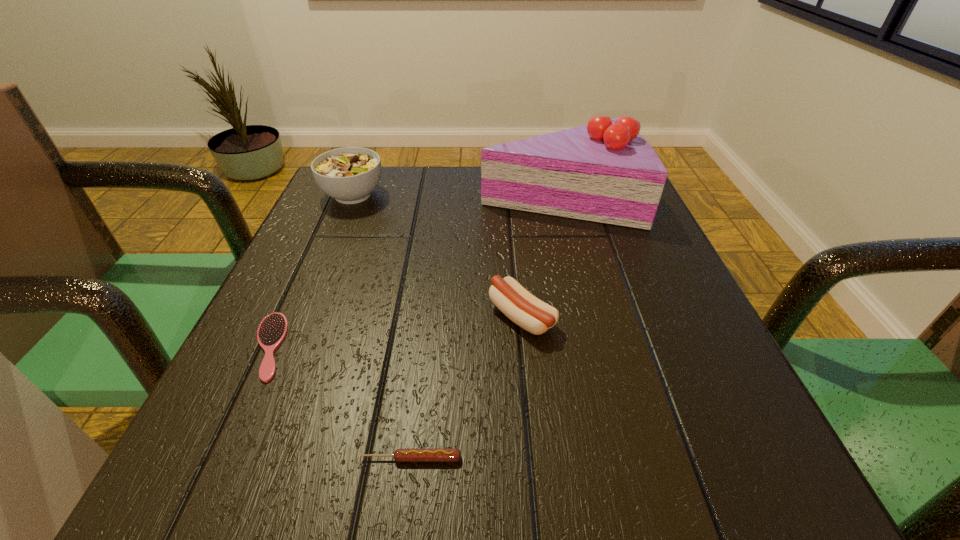
Where is `vacant region at the near edge of the desktop`? This screenshot has width=960, height=540. vacant region at the near edge of the desktop is located at coordinates (496, 464).

Identify the location of vacant space at the left edge. This screenshot has width=960, height=540. (317, 369).

This screenshot has width=960, height=540. I want to click on vacant space at the right edge of the desktop, so click(660, 240).

The width and height of the screenshot is (960, 540). In order to click on vacant space at the near left corner of the desktop in this screenshot , I will do `click(201, 449)`.

You are a GUI agent. You are given a task and a screenshot of the screen. Output one action in this format:
    pyautogui.click(x=<x>, y=<y>)
    Task: Click on the free point at the near right corner
    Image resolution: width=960 pixels, height=540 pixels.
    Given the screenshot: What is the action you would take?
    pyautogui.click(x=747, y=495)

Locate an element on the screen. The image size is (960, 540). unoccupied position between the second tallest object and the hairbrush is located at coordinates (311, 271).

At what (x,y) coordinates should I click in order to perform the action: click on free spot between the nearer sausage and the farther sausage. Please return your answer as a coordinate pair (x, y). Looking at the image, I should click on (467, 388).

At what (x,y) coordinates should I click in order to perform the action: click on free space between the cake and the second tallest object. Please return your answer as a coordinate pair (x, y). Looking at the image, I should click on (456, 196).

What are the coordinates of `vacant space that is in between the farther sausage and the third object from right to left` in the screenshot? It's located at (467, 388).

Find the location of a particular element. This screenshot has width=960, height=540. blank region between the nearest object and the hairbrush is located at coordinates (340, 402).